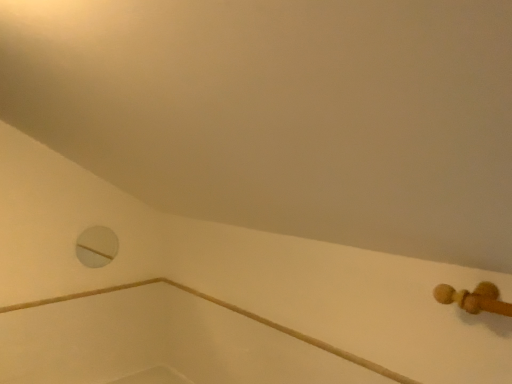
In order to face wooden rail at lower right, should I rotate leftwards or rightwards?

To face it directly, rotate left by 0.199 degrees.

Describe the element at coordinates (228, 309) in the screenshot. The width and height of the screenshot is (512, 384). I see `wooden rail at lower right` at that location.

At what (x,y) coordinates should I click in order to perform the action: click on wooden rail at lower right. Please return your answer as a coordinate pair (x, y). Looking at the image, I should click on (228, 309).

In the scene shown: What is the approximate width of wooden rail at lower right?

0.92 inches.

Where is `white matte hole at upper left`? This screenshot has width=512, height=384. white matte hole at upper left is located at coordinates (96, 246).

This screenshot has height=384, width=512. What do you see at coordinates (96, 246) in the screenshot?
I see `white matte hole at upper left` at bounding box center [96, 246].

At what (x,y) coordinates should I click in order to perform the action: click on wooden rail at lower right. Please return your answer as a coordinate pair (x, y). This screenshot has width=512, height=384. Looking at the image, I should click on (228, 309).

Considering the relative positions of wooden rail at lower right and white matte hole at upper left in the image provided, is wooden rail at lower right to the left of white matte hole at upper left from the viewer's perspective?

In fact, wooden rail at lower right is to the right of white matte hole at upper left.

Considering their positions, is wooden rail at lower right located in front of or behind white matte hole at upper left?

Clearly, wooden rail at lower right is in front of white matte hole at upper left.

Is point (352, 360) more distant than point (99, 266)?

No.

From the image's perspective, which is below, wooden rail at lower right or white matte hole at upper left?

wooden rail at lower right is shown below in the image.

From a real-world perspective, does wooden rail at lower right stand above white matte hole at upper left?

No.

Considering the sizes of objects wooden rail at lower right and white matte hole at upper left in the image provided, who is wider, wooden rail at lower right or white matte hole at upper left?

wooden rail at lower right.

Is wooden rail at lower right taller or shorter than white matte hole at upper left?

Considering their sizes, wooden rail at lower right has less height than white matte hole at upper left.

Looking at the image, does wooden rail at lower right seem bigger or smaller compared to white matte hole at upper left?

Clearly, wooden rail at lower right is larger in size than white matte hole at upper left.

Is wooden rail at lower right located outside white matte hole at upper left?

Yes, wooden rail at lower right is not within white matte hole at upper left.

Is wooden rail at lower right directly adjacent to white matte hole at upper left?

No, wooden rail at lower right is not touching white matte hole at upper left.

Could you tell me if wooden rail at lower right is facing white matte hole at upper left?

No, wooden rail at lower right is not facing towards white matte hole at upper left.

What's the angular difference between wooden rail at lower right and white matte hole at upper left's facing directions?

wooden rail at lower right and white matte hole at upper left are facing 89.8 degrees away from each other.

This screenshot has width=512, height=384. In order to click on bath in front of the white matte hole at upper left in this screenshot , I will do `click(228, 309)`.

Considering the relative positions of white matte hole at upper left and wooden rail at lower right in the image provided, is white matte hole at upper left to the left or to the right of wooden rail at lower right?

Clearly, white matte hole at upper left is on the left of wooden rail at lower right in the image.

Considering the positions of objects white matte hole at upper left and wooden rail at lower right in the image provided, who is behind, white matte hole at upper left or wooden rail at lower right?

white matte hole at upper left is behind.

Does point (93, 235) appear closer or farther from the camera than point (373, 362)?

Point (93, 235) is positioned farther from the camera compared to point (373, 362).

Looking at this image, from the image's perspective, relative to wooden rail at lower right, is white matte hole at upper left above or below?

From the image's perspective, white matte hole at upper left appears above wooden rail at lower right.

From a real-world perspective, is white matte hole at upper left over wooden rail at lower right?

Correct, in the physical world, white matte hole at upper left is higher than wooden rail at lower right.

Between white matte hole at upper left and wooden rail at lower right, which one has larger width?

Wider between the two is wooden rail at lower right.

Does white matte hole at upper left have a lesser height compared to wooden rail at lower right?

No, white matte hole at upper left is not shorter than wooden rail at lower right.

Which of these two, white matte hole at upper left or wooden rail at lower right, is smaller?

Smaller between the two is white matte hole at upper left.

Would you say wooden rail at lower right is part of white matte hole at upper left's contents?

Actually, wooden rail at lower right is outside white matte hole at upper left.

Is white matte hole at upper left far from wooden rail at lower right?

Actually, white matte hole at upper left and wooden rail at lower right are a little close together.

Is white matte hole at upper left oriented towards wooden rail at lower right?

Yes, white matte hole at upper left is oriented towards wooden rail at lower right.

Looking at this image, measure the distance between white matte hole at upper left and wooden rail at lower right.

The distance of white matte hole at upper left from wooden rail at lower right is 24.42 inches.

Where is `hole above the wooden rail at lower right (from a real-world perspective)`? hole above the wooden rail at lower right (from a real-world perspective) is located at coordinates (96, 246).

At what (x,y) coordinates should I click in order to perform the action: click on hole located above the wooden rail at lower right (from the image's perspective). Please return your answer as a coordinate pair (x, y). Looking at the image, I should click on (96, 246).

You are a GUI agent. You are given a task and a screenshot of the screen. Output one action in this format:
    pyautogui.click(x=<x>, y=<y>)
    Task: Click on the bath in front of the white matte hole at upper left
    The width and height of the screenshot is (512, 384).
    Given the screenshot: What is the action you would take?
    pyautogui.click(x=228, y=309)